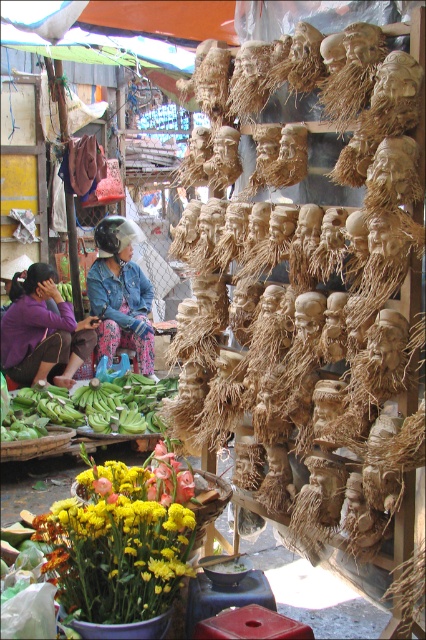
Does point (49, 356) come farther from viewer compared to point (91, 426)?

That is True.

Who is more forward, (x=80, y=364) or (x=140, y=410)?

Point (x=140, y=410)

Identify the location of purple fabric at lower left. Image resolution: width=426 pixels, height=640 pixels. (43, 330).

Does glossy yellow flowers at lower left appear on the right side of green leafy bananas at lower left?

Indeed, glossy yellow flowers at lower left is positioned on the right side of green leafy bananas at lower left.

Is glossy yellow flowers at lower left bigger than green leafy bananas at lower left?

Incorrect, glossy yellow flowers at lower left is not larger than green leafy bananas at lower left.

Which is behind, point (169, 577) or point (115, 385)?

Point (115, 385)

Find the location of `glossy yellow flowers at lower left`. glossy yellow flowers at lower left is located at coordinates (115, 545).

From the picture: Is denim jacket at center below green leafy bananas at lower left?

Incorrect, denim jacket at center is not positioned below green leafy bananas at lower left.

This screenshot has width=426, height=640. What do you see at coordinates (120, 294) in the screenshot?
I see `denim jacket at center` at bounding box center [120, 294].

Identify the location of denim jacket at center. This screenshot has height=640, width=426. (120, 294).